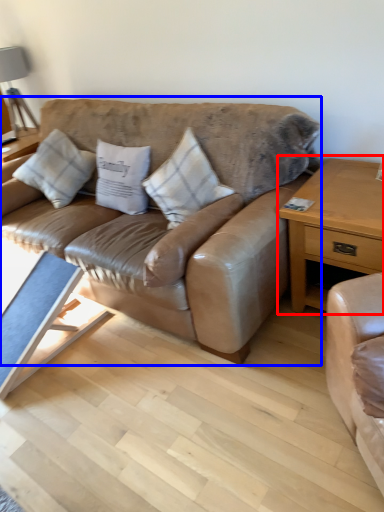
Question: Which point is closer to the camera, nightstand (highlighted by a red box) or studio couch (highlighted by a blue box)?

Choices:
 (A) nightstand
 (B) studio couch

Answer: (B)